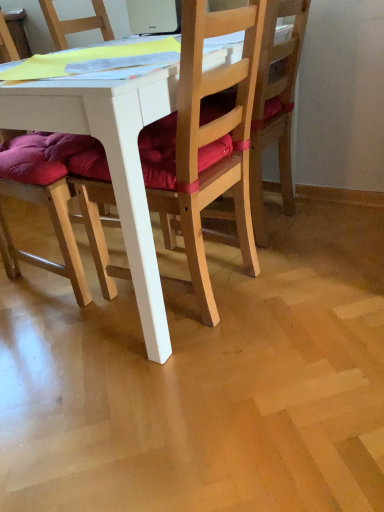
Question: Is white plastic laptop at upper center located outside purple cushioned chair at left, marked as the 3th chair in a right-to-left arrangement?

Choices:
 (A) yes
 (B) no

Answer: (A)

Question: Can you confirm if white plastic laptop at upper center is thinner than purple cushioned chair at left, arranged as the first chair when viewed from the left?

Choices:
 (A) no
 (B) yes

Answer: (B)

Question: From the image's perspective, is white plastic laptop at upper center located beneath purple cushioned chair at left, marked as the 3th chair in a right-to-left arrangement?

Choices:
 (A) no
 (B) yes

Answer: (A)

Question: Is white plastic laptop at upper center shorter than purple cushioned chair at left, marked as the 3th chair in a right-to-left arrangement?

Choices:
 (A) yes
 (B) no

Answer: (A)

Question: Is white plastic laptop at upper center closer to the viewer compared to purple cushioned chair at left, marked as the 3th chair in a right-to-left arrangement?

Choices:
 (A) no
 (B) yes

Answer: (A)

Question: Based on their positions, is wooden chair at center, which appears as the second chair when viewed from the right, located to the left or right of purple cushioned chair at left, marked as the 3th chair in a right-to-left arrangement?

Choices:
 (A) right
 (B) left

Answer: (A)

Question: Relative to purple cushioned chair at left, arranged as the first chair when viewed from the left, is wooden chair at center, positioned as the second chair in left-to-right order, in front or behind?

Choices:
 (A) front
 (B) behind

Answer: (A)

Question: Is wooden chair at center, positioned as the second chair in left-to-right order, spatially inside purple cushioned chair at left, arranged as the first chair when viewed from the left, or outside of it?

Choices:
 (A) outside
 (B) inside

Answer: (A)

Question: From a real-world perspective, relative to purple cushioned chair at left, marked as the 3th chair in a right-to-left arrangement, is wooden chair at center, which appears as the second chair when viewed from the right, vertically above or below?

Choices:
 (A) below
 (B) above

Answer: (A)

Question: In terms of size, does purple cushioned chair at left, marked as the 3th chair in a right-to-left arrangement, appear bigger or smaller than white plastic laptop at upper center?

Choices:
 (A) small
 (B) big

Answer: (B)

Question: Which is correct: purple cushioned chair at left, arranged as the first chair when viewed from the left, is inside white plastic laptop at upper center, or outside of it?

Choices:
 (A) outside
 (B) inside

Answer: (A)

Question: From the image's perspective, is purple cushioned chair at left, arranged as the first chair when viewed from the left, located above or below white plastic laptop at upper center?

Choices:
 (A) above
 (B) below

Answer: (B)

Question: Would you say purple cushioned chair at left, arranged as the first chair when viewed from the left, is to the left or to the right of white plastic laptop at upper center in the picture?

Choices:
 (A) left
 (B) right

Answer: (A)

Question: From the image's perspective, relative to purple cushioned chair at left, arranged as the first chair when viewed from the left, is white plastic laptop at upper center above or below?

Choices:
 (A) below
 (B) above

Answer: (B)

Question: Is white plastic laptop at upper center taller or shorter than purple cushioned chair at left, marked as the 3th chair in a right-to-left arrangement?

Choices:
 (A) short
 (B) tall

Answer: (A)